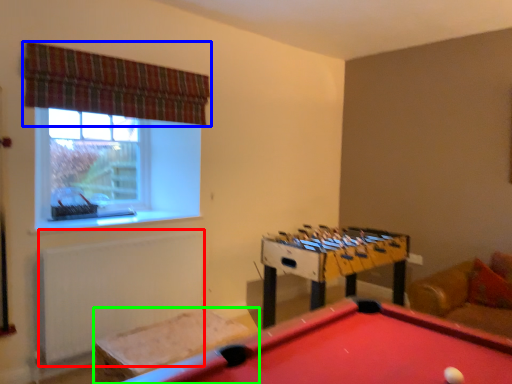
Question: Considering the real-world distances, which object is farthest from radiator (highlighted by a red box)? curtain (highlighted by a blue box) or furniture (highlighted by a green box)?

Choices:
 (A) curtain
 (B) furniture

Answer: (A)